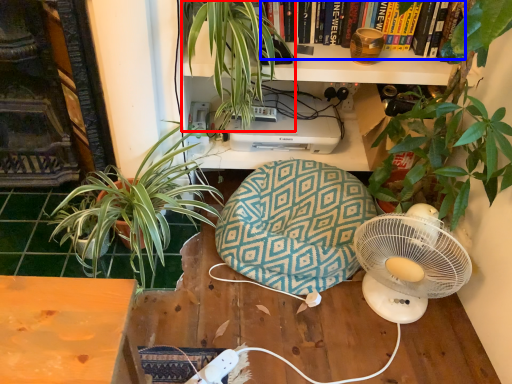
Question: Which object appears farthest to the camera in this image, houseplant (highlighted by a red box) or book (highlighted by a blue box)?

Choices:
 (A) houseplant
 (B) book

Answer: (B)